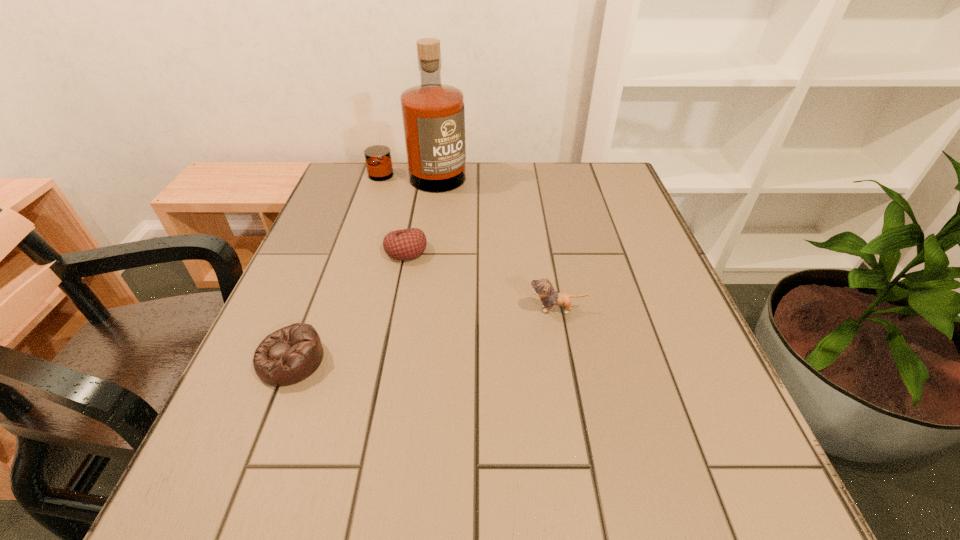
Identify the location of blank region between the left beanbag and the second tallest object. The height and width of the screenshot is (540, 960). (424, 335).

Find the location of `free space between the farthest object and the farther beanbag`. free space between the farthest object and the farther beanbag is located at coordinates (412, 214).

Locate an element on the screen. This screenshot has height=540, width=960. free space between the nearer beanbag and the second nearest object is located at coordinates (424, 335).

At what (x,y) coordinates should I click in order to perform the action: click on object that is the second nearest to the farthest object. Please return your answer as a coordinate pair (x, y). This screenshot has height=540, width=960. Looking at the image, I should click on (543, 288).

In order to click on the third closest object to the farthest object in this screenshot , I will do `click(289, 355)`.

Locate an element on the screen. vacant space that satisfies the following two spatial constraints: 1. on the back side of the farther beanbag; 2. on the right side of the left beanbag is located at coordinates 334,251.